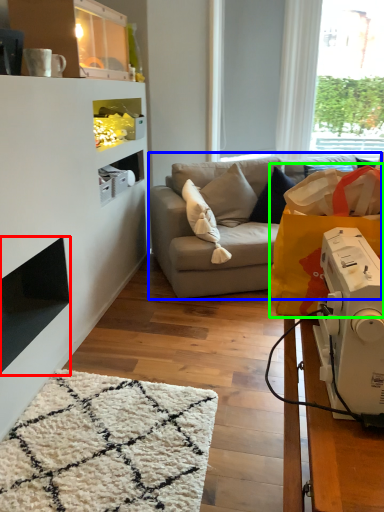
Question: Which is nearer to the fireplace (highlighted by a red box)? studio couch (highlighted by a blue box) or grocery bag (highlighted by a green box).

Choices:
 (A) studio couch
 (B) grocery bag

Answer: (A)